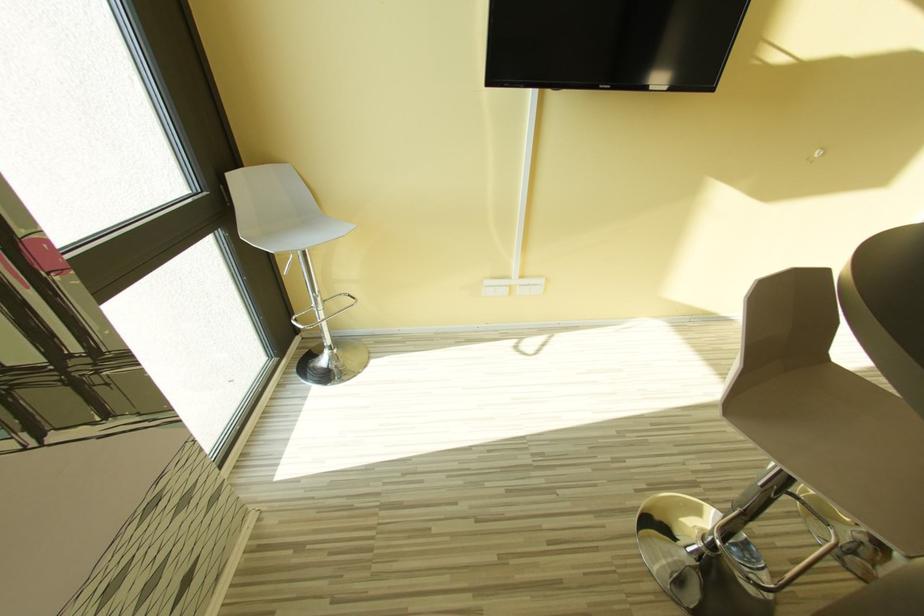
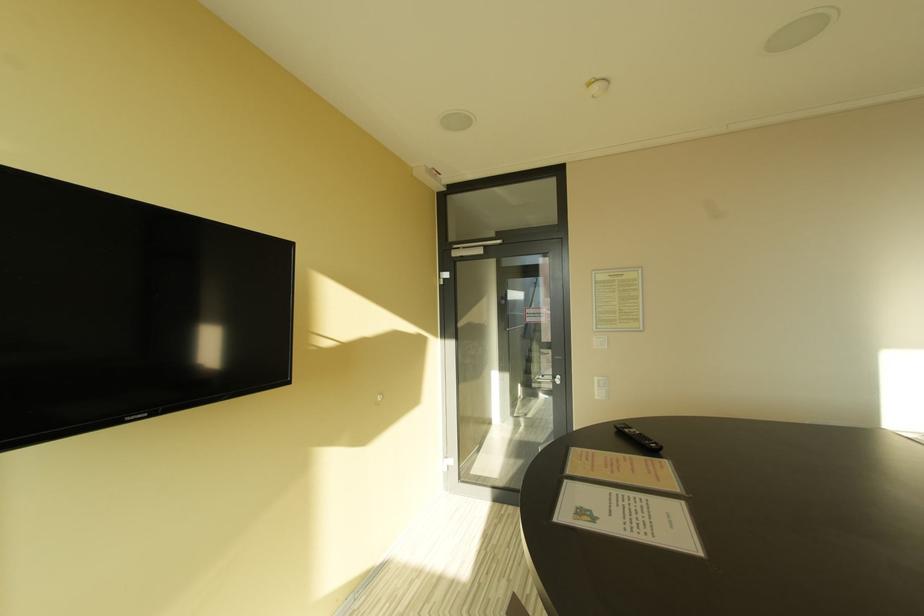
Question: Based on the continuous images, in which direction is the camera rotating? Reply with the corresponding letter.

Choices:
 (A) Left
 (B) Right
 (C) Up
 (D) Down

Answer: (B)